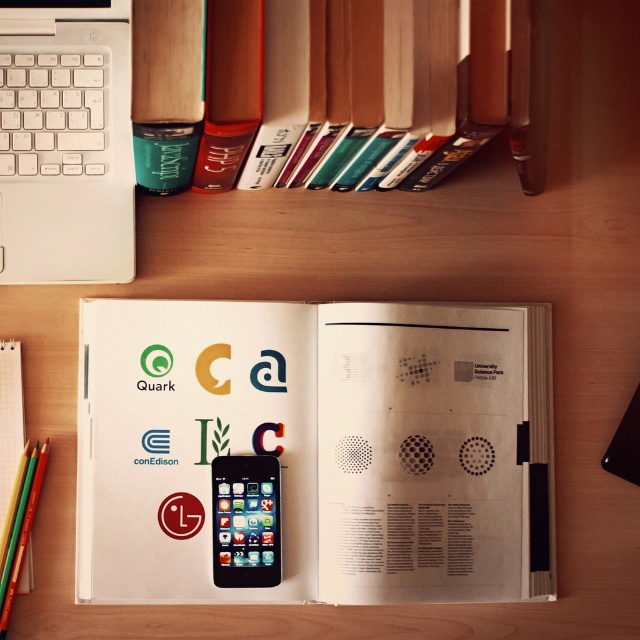
You are organizing items on a desk and want to place a 10 inch wide ruler between the white matte laptop at upper left and the teal matte cup at upper left. Can the ruler fit between them without overlapping either object?

The distance between the white matte laptop at upper left and the teal matte cup at upper left is 9.45 inches. Since the ruler is 10 inches wide, it cannot fit between them without overlapping either object.

You are a graphic designer working on a project and need to locate your white matte laptop at upper left. Where exactly is it positioned on the desk?

The white matte laptop at upper left is positioned at point (65,141) on the desk.

Consider the image. You are a photographer preparing to take a closeup shot of the white matte laptop at upper left. The camera you are using has a minimum focusing distance of 60 centimeters. Can you take the photo without moving either the camera or the laptop?

The white matte laptop at upper left and camera are 62.18 centimeters apart. Since the minimum focusing distance is 60 centimeters, the camera can focus on the white matte laptop at upper left from this distance. However, since the distance is slightly more than the minimum, the photo might be slightly out of focus or require adjusting the camera settings for optimal clarity.